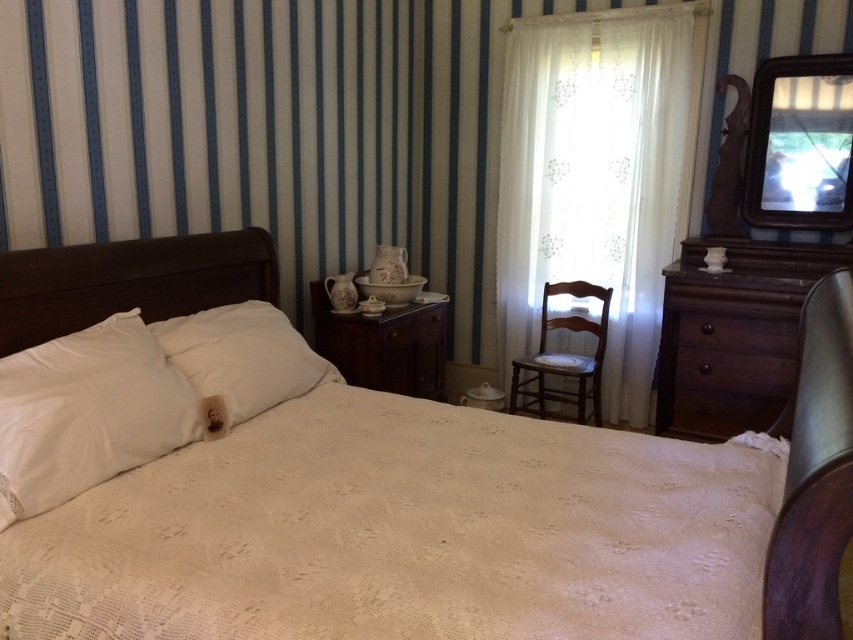
Is brown wood drawer at right to the right of matte wood drawer at center from the viewer's perspective?

Indeed, brown wood drawer at right is positioned on the right side of matte wood drawer at center.

Which is in front, point (724, 326) or point (434, 320)?

Positioned in front is point (724, 326).

Find the location of `brown wood drawer at right`. brown wood drawer at right is located at coordinates (737, 333).

Does white lace bedspread at center appear on the right side of white soft pillow at left?

Incorrect, white lace bedspread at center is not on the right side of white soft pillow at left.

Can you confirm if white lace bedspread at center is wider than white soft pillow at left?

Yes.

Describe the element at coordinates (129, 280) in the screenshot. This screenshot has width=853, height=640. I see `white lace bedspread at center` at that location.

Locate an element on the screen. The height and width of the screenshot is (640, 853). white lace bedspread at center is located at coordinates (129, 280).

Does point (189, 257) lie behind point (747, 285)?

No, it is not.

Which is above, white lace bedspread at center or dark wood dresser at right?

white lace bedspread at center is higher up.

Which is in front, point (227, 234) or point (770, 248)?

Point (227, 234)

Identify the location of white lace bedspread at center. (129, 280).